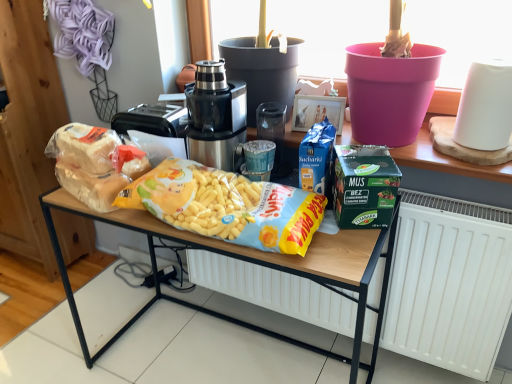
Question: From the image's perspective, is yellow matte corn at center, which ranks as the first cereal in right-to-left order, over green matte lunch box at center?

Choices:
 (A) no
 (B) yes

Answer: (A)

Question: Is yellow matte corn at center, which ranks as the first cereal in right-to-left order, further to the viewer compared to green matte lunch box at center?

Choices:
 (A) yes
 (B) no

Answer: (B)

Question: Is yellow matte corn at center, which appears as the 2th cereal when viewed from the left, thinner than green matte lunch box at center?

Choices:
 (A) no
 (B) yes

Answer: (A)

Question: Does yellow matte corn at center, which appears as the 2th cereal when viewed from the left, have a smaller size compared to green matte lunch box at center?

Choices:
 (A) yes
 (B) no

Answer: (B)

Question: Can you confirm if yellow matte corn at center, which appears as the 2th cereal when viewed from the left, is shorter than green matte lunch box at center?

Choices:
 (A) no
 (B) yes

Answer: (B)

Question: From the image's perspective, is green matte lunch box at center positioned above or below yellow matte corn at center, which ranks as the first cereal in right-to-left order?

Choices:
 (A) below
 (B) above

Answer: (B)

Question: In terms of width, does green matte lunch box at center look wider or thinner when compared to yellow matte corn at center, which appears as the 2th cereal when viewed from the left?

Choices:
 (A) wide
 (B) thin

Answer: (B)

Question: Do you think green matte lunch box at center is within yellow matte corn at center, which ranks as the first cereal in right-to-left order, or outside of it?

Choices:
 (A) inside
 (B) outside

Answer: (B)

Question: Considering their positions, is green matte lunch box at center located in front of or behind yellow matte corn at center, which appears as the 2th cereal when viewed from the left?

Choices:
 (A) front
 (B) behind

Answer: (B)

Question: In the image, is green matte lunch box at center on the left side or the right side of satin black juicer at center?

Choices:
 (A) right
 (B) left

Answer: (A)

Question: From a real-world perspective, relative to satin black juicer at center, is green matte lunch box at center vertically above or below?

Choices:
 (A) above
 (B) below

Answer: (B)

Question: Do you think green matte lunch box at center is within satin black juicer at center, or outside of it?

Choices:
 (A) outside
 (B) inside

Answer: (A)

Question: In terms of width, does green matte lunch box at center look wider or thinner when compared to satin black juicer at center?

Choices:
 (A) thin
 (B) wide

Answer: (A)

Question: Visually, is translucent plastic bag of bread at left, which ranks as the first cereal in left-to-right order, positioned to the left or to the right of white matte radiator at lower center?

Choices:
 (A) left
 (B) right

Answer: (A)

Question: Considering their positions, is translucent plastic bag of bread at left, which is the 2th cereal from right to left, located in front of or behind white matte radiator at lower center?

Choices:
 (A) behind
 (B) front

Answer: (A)